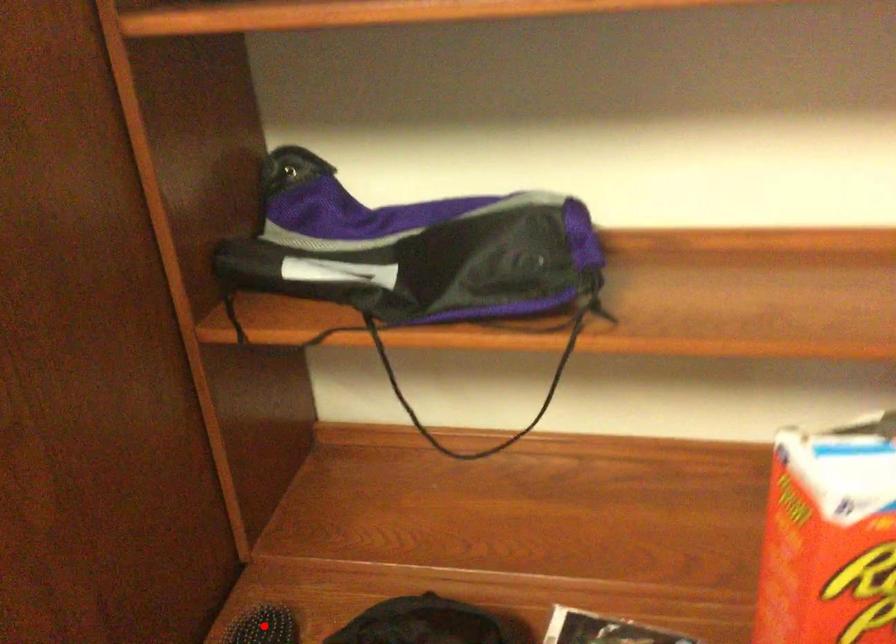
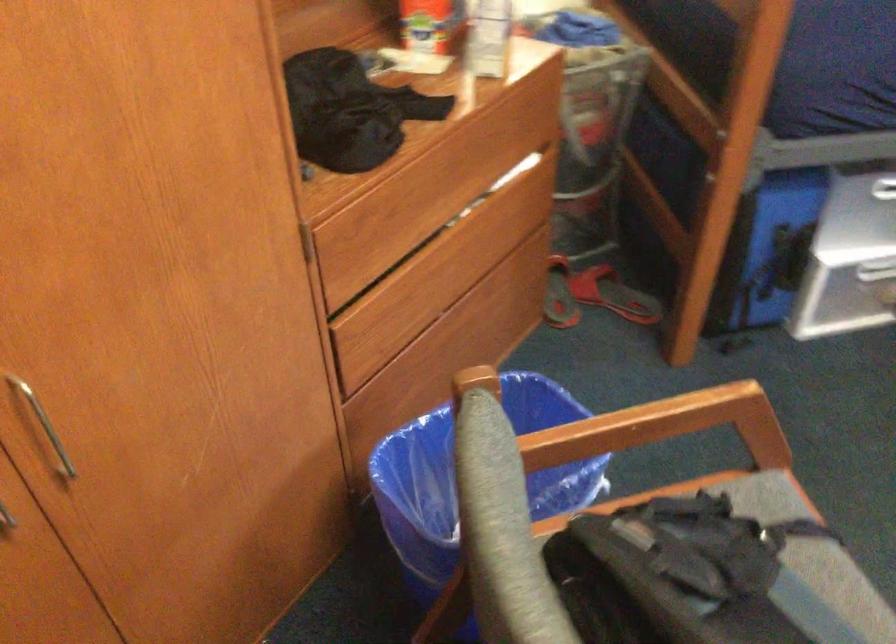
Question: I am providing you with two images of the same scene from different viewpoints. A red point is marked on the first image. Is the red point's position out of view in image 2?

Choices:
 (A) Yes
 (B) No

Answer: (A)